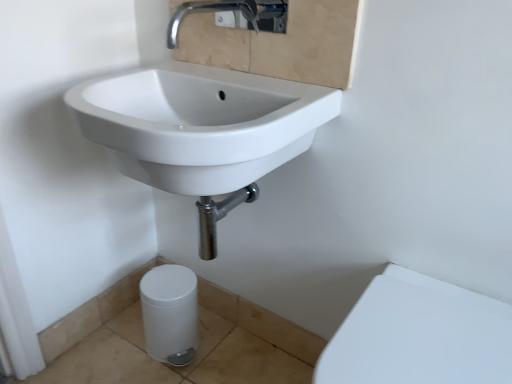
Question: Is white glossy trash can at lower left, positioned as the 2th porcelain in right-to-left order, oriented towards chrome metallic faucet at upper center?

Choices:
 (A) yes
 (B) no

Answer: (B)

Question: Does white glossy trash can at lower left, the first porcelain viewed from the left, contain chrome metallic faucet at upper center?

Choices:
 (A) no
 (B) yes

Answer: (A)

Question: Does white glossy trash can at lower left, arranged as the 2th porcelain when viewed from the front, have a lesser width compared to chrome metallic faucet at upper center?

Choices:
 (A) no
 (B) yes

Answer: (B)

Question: Considering the relative sizes of white glossy trash can at lower left, the first porcelain viewed from the left, and chrome metallic faucet at upper center in the image provided, is white glossy trash can at lower left, the first porcelain viewed from the left, shorter than chrome metallic faucet at upper center?

Choices:
 (A) no
 (B) yes

Answer: (A)

Question: From a real-world perspective, is white glossy trash can at lower left, positioned as the 2th porcelain in right-to-left order, on chrome metallic faucet at upper center?

Choices:
 (A) yes
 (B) no

Answer: (B)

Question: Considering the positions of point (141, 286) and point (269, 23), is point (141, 286) closer or farther from the camera than point (269, 23)?

Choices:
 (A) closer
 (B) farther

Answer: (A)

Question: In terms of width, does white glossy trash can at lower left, the first porcelain viewed from the left, look wider or thinner when compared to chrome metallic faucet at upper center?

Choices:
 (A) thin
 (B) wide

Answer: (A)

Question: Choose the correct answer: Is white glossy trash can at lower left, which ranks as the first porcelain in back-to-front order, inside chrome metallic faucet at upper center or outside it?

Choices:
 (A) outside
 (B) inside

Answer: (A)

Question: From a real-world perspective, relative to chrome metallic faucet at upper center, is white glossy trash can at lower left, positioned as the 2th porcelain in right-to-left order, vertically above or below?

Choices:
 (A) below
 (B) above

Answer: (A)

Question: Based on their sizes in the image, would you say white glossy trash can at lower left, arranged as the 2th porcelain when viewed from the front, is bigger or smaller than white glossy porcelain at lower right, marked as the first porcelain in a front-to-back arrangement?

Choices:
 (A) big
 (B) small

Answer: (B)

Question: From the image's perspective, is white glossy trash can at lower left, which ranks as the first porcelain in back-to-front order, positioned above or below white glossy porcelain at lower right, marked as the first porcelain in a front-to-back arrangement?

Choices:
 (A) below
 (B) above

Answer: (B)

Question: Is white glossy trash can at lower left, arranged as the 2th porcelain when viewed from the front, to the left or to the right of white glossy porcelain at lower right, arranged as the 2th porcelain when viewed from the left, in the image?

Choices:
 (A) left
 (B) right

Answer: (A)

Question: Would you say white glossy trash can at lower left, which ranks as the first porcelain in back-to-front order, is inside or outside white glossy porcelain at lower right, marked as the first porcelain in a front-to-back arrangement?

Choices:
 (A) outside
 (B) inside

Answer: (A)

Question: In the image, is white glossy porcelain at lower right, which is the first porcelain in right-to-left order, on the left side or the right side of white glossy sink at upper left?

Choices:
 (A) left
 (B) right

Answer: (B)

Question: Considering the positions of white glossy porcelain at lower right, the second porcelain positioned from the back, and white glossy sink at upper left in the image, is white glossy porcelain at lower right, the second porcelain positioned from the back, wider or thinner than white glossy sink at upper left?

Choices:
 (A) wide
 (B) thin

Answer: (A)